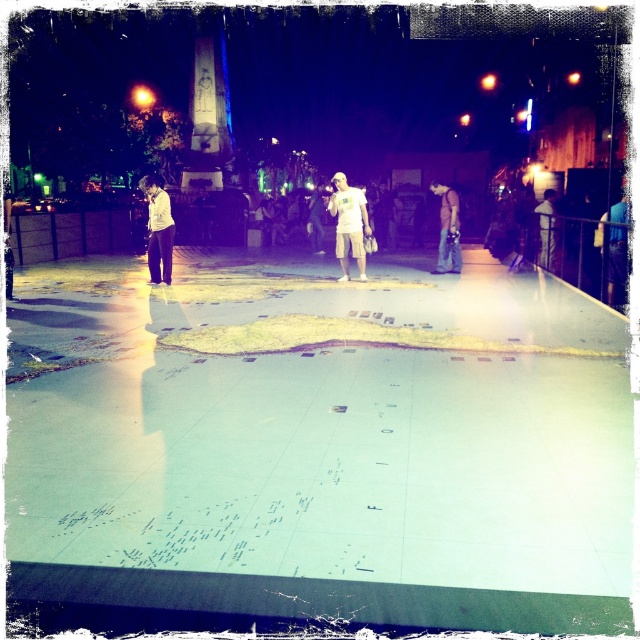
You are an event organizer at the interactive map exhibit. You notice two participants wearing a white matte shirt at center and a light brown leather jacket at center. Which participant is standing closer to the ground?

The white matte shirt at center is positioned under the light brown leather jacket at center, so the participant wearing the white matte shirt at center is standing closer to the ground.

You are a photographer positioned at the edge of the map installation. You want to take a photo of the denim jeans at center and light brown leather jacket at center such that both are clearly visible. Given that your camera has a fixed focal length, which object should you focus on first to ensure both are in focus?

The denim jeans at center is taller than light brown leather jacket at center. To ensure both are in focus, you should focus on the denim jeans at center because it is taller and thus farther away from the camera, allowing the depth of field to cover the closer light brown leather jacket at center.